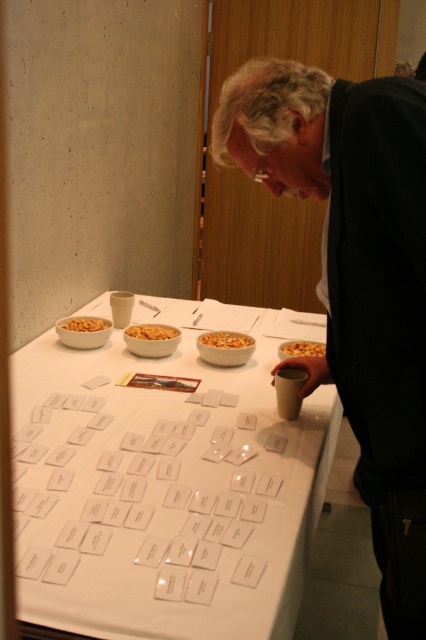
From the picture: You are at the table and want to grab the cereal that is nearest to you. Which one should you choose between the golden crunchy cereal at center and the golden crunchy cereal at left?

The golden crunchy cereal at center is closer to the viewer, so you should choose the golden crunchy cereal at center.

You are a photographer standing at the camera position. You want to capture a closeup of the golden crunchy cereal at center. Can you get a clear shot without moving the camera? The minimum focusing distance of your camera is 1.5 meters.

The golden crunchy cereal at center and camera are 1.64 meters apart. Since the minimum focusing distance is 1.5 meters, you can get a clear shot without moving the camera because the distance is within range.

You are a guest at a party and see the smooth white bowl at center and the golden crunchy cereal at left on the table. Which object is larger in size?

The smooth white bowl at center is bigger than the golden crunchy cereal at left.